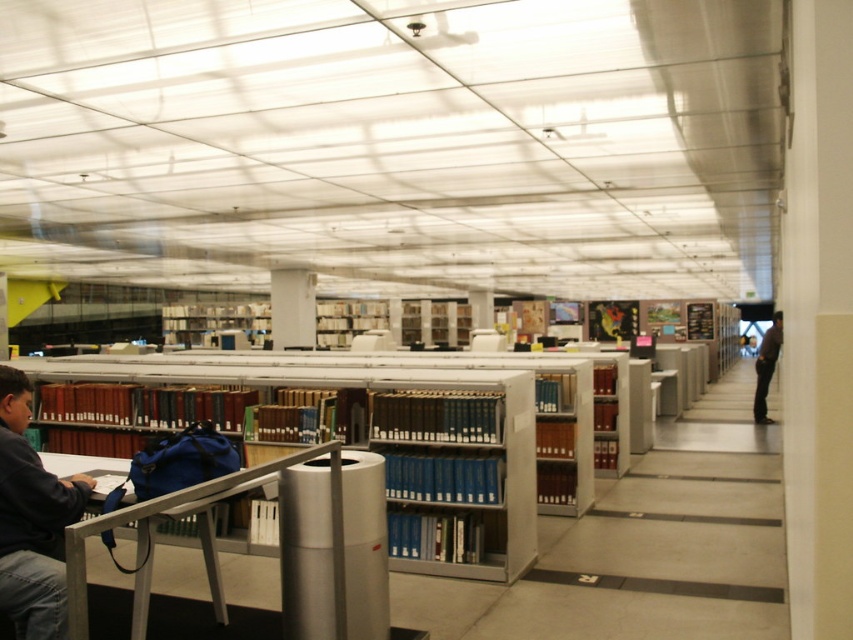
Does blue plastic bookshelf at center have a smaller size compared to dark brown leather jacket at right?

Yes, blue plastic bookshelf at center is smaller than dark brown leather jacket at right.

Is blue plastic bookshelf at center to the right of dark brown leather jacket at right from the viewer's perspective?

In fact, blue plastic bookshelf at center is to the left of dark brown leather jacket at right.

Describe the element at coordinates (422, 445) in the screenshot. I see `blue plastic bookshelf at center` at that location.

Image resolution: width=853 pixels, height=640 pixels. I want to click on blue plastic bookshelf at center, so click(422, 445).

Who is shorter, blue plastic bookshelf at center or dark blue jacket at lower left?

With less height is dark blue jacket at lower left.

Which is above, blue plastic bookshelf at center or dark blue jacket at lower left?

Positioned higher is blue plastic bookshelf at center.

Is point (360, 378) positioned behind point (39, 472)?

Yes, point (360, 378) is behind point (39, 472).

Identify the location of blue plastic bookshelf at center. The width and height of the screenshot is (853, 640). (422, 445).

Between point (22, 464) and point (763, 349), which one is positioned in front?

Point (22, 464) is more forward.

Between dark blue jacket at lower left and dark brown leather jacket at right, which one is positioned higher?

Positioned higher is dark blue jacket at lower left.

Between point (19, 637) and point (761, 413), which one is positioned in front?

Point (19, 637) is more forward.

Where is `dark blue jacket at lower left`? Image resolution: width=853 pixels, height=640 pixels. dark blue jacket at lower left is located at coordinates [x=32, y=520].